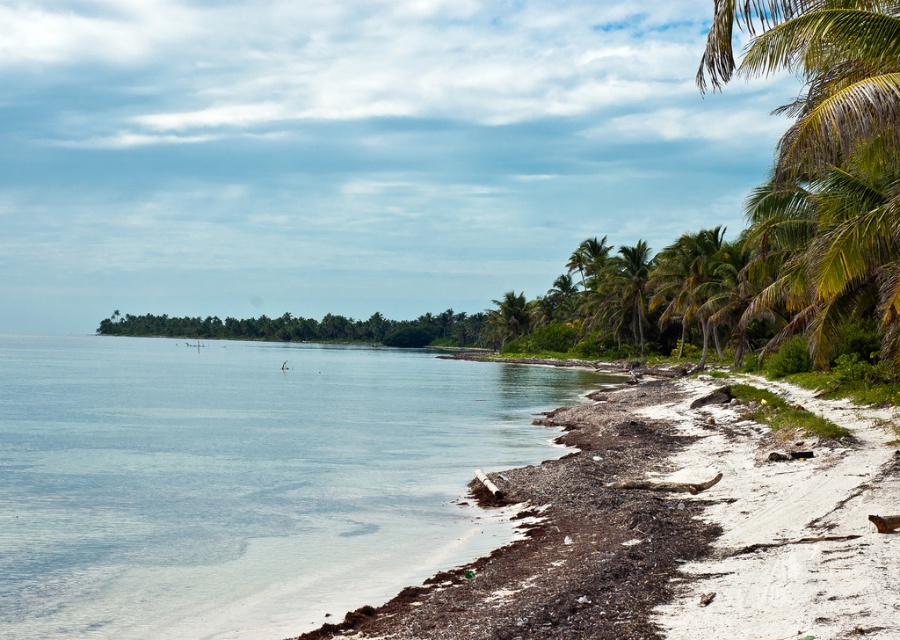
You are standing at the center of the beach in the image. You see a point labeled as point (677,528). Based on the scene description, what is the location of this point relative to the beach and the sea?

The point (677,528) corresponds to brown sand at lower right, which is located near the shoreline where the sand meets the sea.